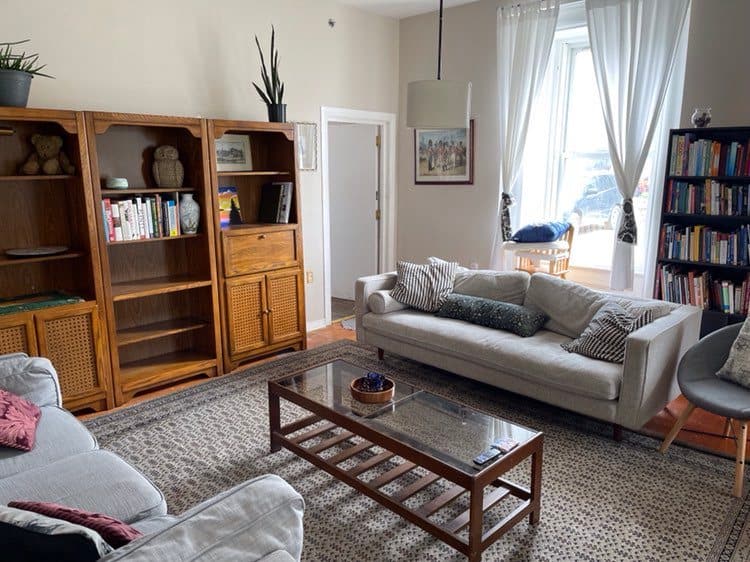
Locate an element on the screen. owl statue is located at coordinates (160, 165).